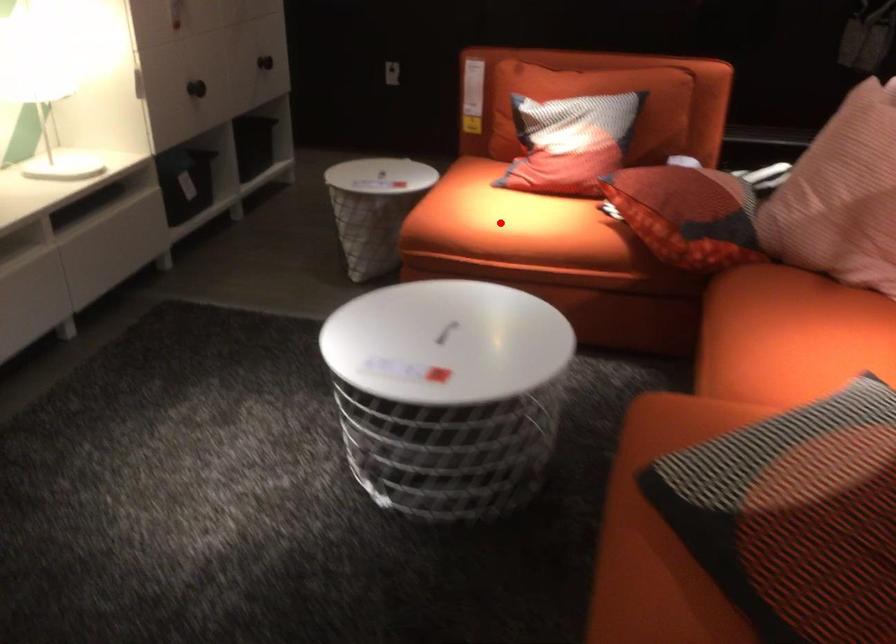
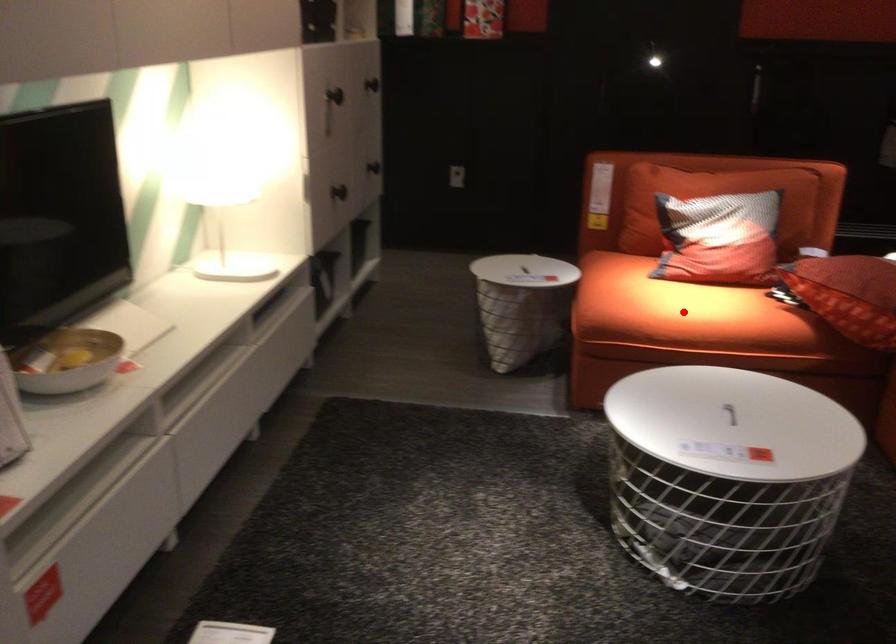
I am providing you with two images of the same scene from different viewpoints. A red point is marked on the first image and another point is marked on the second image. Is the red point in image1 aligned with the point shown in image2?

Yes